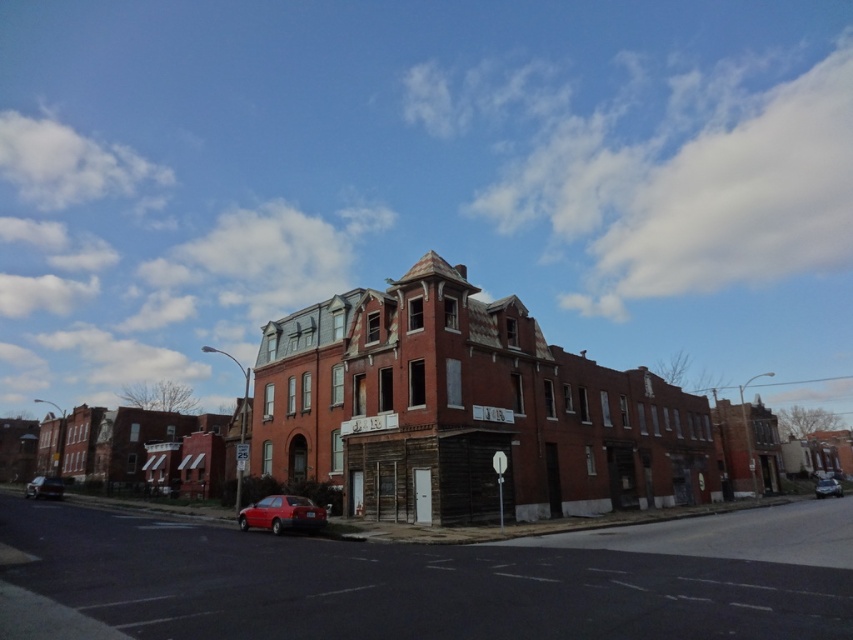
Who is positioned more to the right, shiny red sedan at lower center or metallic silver sedan at lower right?

metallic silver sedan at lower right

Does shiny red sedan at lower center have a greater height compared to metallic silver sedan at lower right?

No.

I want to click on shiny red sedan at lower center, so click(x=282, y=515).

Find the location of `shiny red sedan at lower center`. shiny red sedan at lower center is located at coordinates (282, 515).

Who is more distant from viewer, (50, 493) or (817, 496)?

The point (817, 496) is more distant.

Which is above, shiny red car at lower left or metallic silver sedan at lower right?

shiny red car at lower left

Locate an element on the screen. The width and height of the screenshot is (853, 640). shiny red car at lower left is located at coordinates point(44,486).

How distant is shiny red sedan at lower center from shiny red car at lower left?

139.26 feet

Which of these two, shiny red sedan at lower center or shiny red car at lower left, stands taller?

With more height is shiny red car at lower left.

The image size is (853, 640). Describe the element at coordinates (282, 515) in the screenshot. I see `shiny red sedan at lower center` at that location.

This screenshot has width=853, height=640. Identify the location of shiny red sedan at lower center. (282, 515).